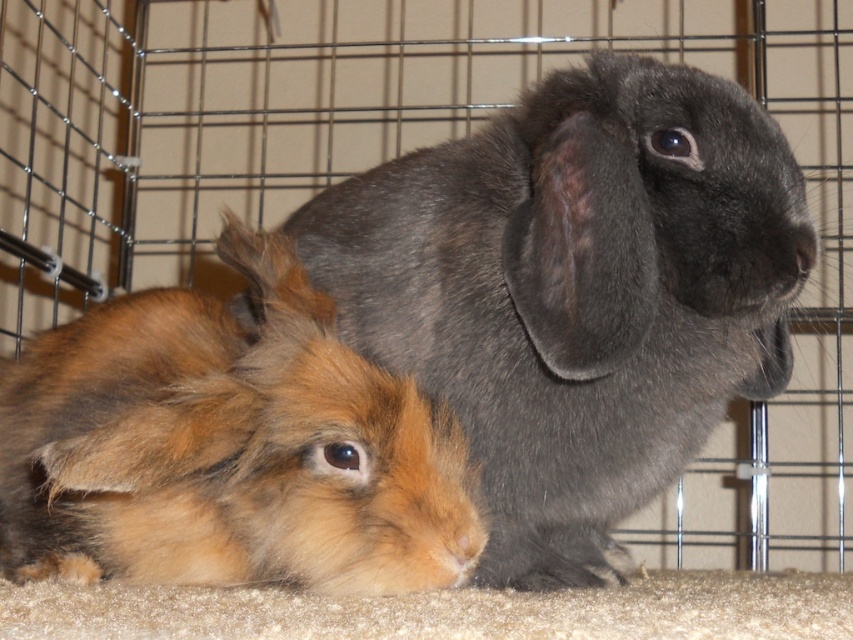
You are a small toy that is 10 cm tall. You want to place yourself between the gray soft fur rabbit at center and the brown fluffy rabbit at lower left. Can you fit in the space between them without touching either rabbit?

The gray soft fur rabbit at center is taller than the brown fluffy rabbit at lower left. Since the toy is only 10 cm tall, it can fit between them as long as there is enough horizontal space. However, the question does not provide information about the horizontal distance between the rabbits, so we cannot determine if the toy can fit vertically. The answer should focus on the vertical clearance. Since the taller rabbit is gray and the toy is 10 cm, if the vertical space between them allows, it might fit,

You are a caretaker checking the cage layout. The gray soft fur rabbit at center is positioned where? Please state its coordinates based on the cage grid system.

The gray soft fur rabbit at center is located at point (577,291) according to the cage grid system.

You are a pet store employee who needs to clean the rabbits cage. You have a small brush that is 6 inches long. If you want to clean both rabbits without moving them, can you reach from the brown fluffy rabbit at lower left to the gray soft fur rabbit at center with your brush?

The gray soft fur rabbit at center and brown fluffy rabbit at lower left are 7.66 inches apart from each other. Since the brush is only 6 inches long, you cannot reach from the brown fluffy rabbit at lower left to the gray soft fur rabbit at center without moving them.